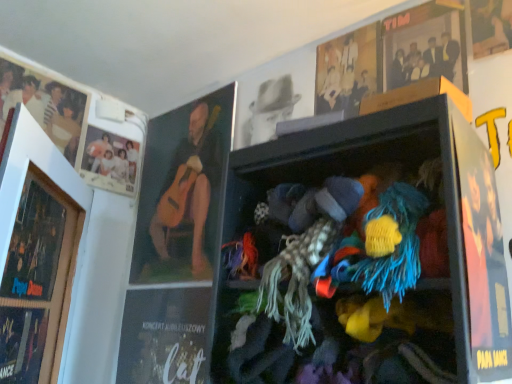
Locate an element on the screen. This screenshot has width=512, height=384. matte black magazine at lower left, which is the second magazine in back-to-front order is located at coordinates (22, 344).

What are the coordinates of `oil-painted guitar at upper left, which appears as the 2th person when viewed from the right` in the screenshot? It's located at (190, 188).

This screenshot has height=384, width=512. Identify the location of matte white photo at upper left, the 3th person in the right-to-left sequence. (111, 156).

Describe the element at coordinates (483, 255) in the screenshot. I see `matte black poster at right` at that location.

The height and width of the screenshot is (384, 512). I want to click on matte black photo frame at upper left, placed as the fourth person when sorted from right to left, so click(44, 105).

What do you see at coordinates (63, 231) in the screenshot? The width and height of the screenshot is (512, 384). I see `wooden picture frame at left` at bounding box center [63, 231].

This screenshot has width=512, height=384. I want to click on matte black magazine at lower left, which is the 1th magazine from front to back, so click(x=22, y=344).

In terms of width, does wooden picture frame at left look wider or thinner when compared to oil-painted guitar at upper left, which appears as the 2th person when viewed from the right?

In the image, wooden picture frame at left appears to be wider than oil-painted guitar at upper left, which appears as the 2th person when viewed from the right.

Considering the positions of objects wooden picture frame at left and oil-painted guitar at upper left, which is the 3th person in left-to-right order, in the image provided, who is more to the left, wooden picture frame at left or oil-painted guitar at upper left, which is the 3th person in left-to-right order,?

wooden picture frame at left.

From a real-world perspective, is wooden picture frame at left positioned above or below oil-painted guitar at upper left, which appears as the 2th person when viewed from the right?

In terms of real-world spatial position, wooden picture frame at left is below oil-painted guitar at upper left, which appears as the 2th person when viewed from the right.

Looking at this image, considering their positions, is wooden picture frame at left located in front of or behind oil-painted guitar at upper left, which appears as the 2th person when viewed from the right?

Visually, wooden picture frame at left is located in front of oil-painted guitar at upper left, which appears as the 2th person when viewed from the right.

How different are the orientations of matte black photo frame at upper left, placed as the fourth person when sorted from right to left, and matte black poster at right in degrees?

The angle between the facing direction of matte black photo frame at upper left, placed as the fourth person when sorted from right to left, and the facing direction of matte black poster at right is 0.0724 degrees.

Is matte black photo frame at upper left, which is the first person in left-to-right order, oriented away from matte black poster at right?

No.

From a real-world perspective, is matte black photo frame at upper left, which is the first person in left-to-right order, located beneath matte black poster at right?

No.

In the scene shown: Who is taller, matte black photo frame at upper left, which is the first person in left-to-right order, or matte black poster at right?

matte black poster at right.

Is matte black poster at right inside oil-painted guitar at upper left, which appears as the 2th person when viewed from the right?

That's incorrect, matte black poster at right is not inside oil-painted guitar at upper left, which appears as the 2th person when viewed from the right.

Is oil-painted guitar at upper left, which appears as the 2th person when viewed from the right, positioned far away from matte black poster at right?

Yes, oil-painted guitar at upper left, which appears as the 2th person when viewed from the right, and matte black poster at right are quite far apart.

Does oil-painted guitar at upper left, which is the 3th person in left-to-right order, have a greater height compared to matte black poster at right?

Yes.

Which is more to the right, oil-painted guitar at upper left, which is the 3th person in left-to-right order, or matte black poster at right?

From the viewer's perspective, matte black poster at right appears more on the right side.

Is matte black magazine at lower left, which is the first magazine from left to right, wider than oil-painted guitar at upper left, which is the 3th person in left-to-right order?

Yes, matte black magazine at lower left, which is the first magazine from left to right, is wider than oil-painted guitar at upper left, which is the 3th person in left-to-right order.

From a real-world perspective, is matte black magazine at lower left, which is the 1th magazine from front to back, physically below oil-painted guitar at upper left, which appears as the 2th person when viewed from the right?

Correct, in the physical world, matte black magazine at lower left, which is the 1th magazine from front to back, is lower than oil-painted guitar at upper left, which appears as the 2th person when viewed from the right.

Is matte black magazine at lower left, positioned as the 2th magazine in right-to-left order, outside of oil-painted guitar at upper left, which is the 3th person in left-to-right order?

matte black magazine at lower left, positioned as the 2th magazine in right-to-left order, is positioned outside oil-painted guitar at upper left, which is the 3th person in left-to-right order.

Is oil-painted guitar at upper left, which is the 3th person in left-to-right order, at the back of matte black magazine at lower left, which is the second magazine in back-to-front order?

No, matte black magazine at lower left, which is the second magazine in back-to-front order, is not facing the opposite direction of oil-painted guitar at upper left, which is the 3th person in left-to-right order.

In the scene shown: From the image's perspective, relative to matte black magazine at lower left, which is the second magazine in back-to-front order, is oil-painted guitar at upper left, which is the 3th person in left-to-right order, above or below?

From the image's perspective, oil-painted guitar at upper left, which is the 3th person in left-to-right order, appears above matte black magazine at lower left, which is the second magazine in back-to-front order.

From a real-world perspective, is oil-painted guitar at upper left, which appears as the 2th person when viewed from the right, under matte black magazine at lower left, which is the second magazine in back-to-front order?

No.

How many degrees apart are the facing directions of light brown wooden frame at upper center, which ranks as the fourth person in left-to-right order, and oil-painted guitar at upper left, which is the 3th person in left-to-right order?

0.00251 degrees.

Where is `person that is on the right side of oil-painted guitar at upper left, which is the 3th person in left-to-right order`? The width and height of the screenshot is (512, 384). person that is on the right side of oil-painted guitar at upper left, which is the 3th person in left-to-right order is located at coordinates (346, 70).

How much distance is there between light brown wooden frame at upper center, which is counted as the 1th person, starting from the right, and oil-painted guitar at upper left, which appears as the 2th person when viewed from the right?

The distance of light brown wooden frame at upper center, which is counted as the 1th person, starting from the right, from oil-painted guitar at upper left, which appears as the 2th person when viewed from the right, is 24.34 inches.

Which is correct: light brown wooden frame at upper center, which is counted as the 1th person, starting from the right, is inside oil-painted guitar at upper left, which is the 3th person in left-to-right order, or outside of it?

light brown wooden frame at upper center, which is counted as the 1th person, starting from the right, is not inside oil-painted guitar at upper left, which is the 3th person in left-to-right order, it's outside.

How many degrees apart are the facing directions of light brown wooden frame at upper center, which ranks as the fourth person in left-to-right order, and black paper magazine at lower left, the 2th magazine positioned from the left?

The angle between the facing direction of light brown wooden frame at upper center, which ranks as the fourth person in left-to-right order, and the facing direction of black paper magazine at lower left, the 2th magazine positioned from the left, is 0.000731 degrees.

Which object is positioned more to the right, light brown wooden frame at upper center, which is counted as the 1th person, starting from the right, or black paper magazine at lower left, the 2th magazine positioned from the left?

light brown wooden frame at upper center, which is counted as the 1th person, starting from the right, is more to the right.

Which of these two, light brown wooden frame at upper center, which is counted as the 1th person, starting from the right, or black paper magazine at lower left, placed as the 2th magazine when sorted from front to back, is smaller?

light brown wooden frame at upper center, which is counted as the 1th person, starting from the right.

Is the surface of light brown wooden frame at upper center, which ranks as the fourth person in left-to-right order, in direct contact with black paper magazine at lower left, the 2th magazine positioned from the left?

No, light brown wooden frame at upper center, which ranks as the fourth person in left-to-right order, is not with black paper magazine at lower left, the 2th magazine positioned from the left.

Find the location of `picture frame in front of the oil-painted guitar at upper left, which is the 3th person in left-to-right order`. picture frame in front of the oil-painted guitar at upper left, which is the 3th person in left-to-right order is located at coordinates (63, 231).

Identify the location of poster page that appears below the matte black photo frame at upper left, placed as the fourth person when sorted from right to left (from the image's perspective). (483, 255).

Which object lies further to the anchor point wooden picture frame at left, black paper magazine at lower left, the 2th magazine positioned from the left, or matte black poster at right?

matte black poster at right is positioned further to the anchor wooden picture frame at left.

From the image, which object appears to be nearer to matte black magazine at lower left, positioned as the 2th magazine in right-to-left order, matte black photo frame at upper left, which is the first person in left-to-right order, or black paper magazine at lower left, placed as the 2th magazine when sorted from front to back?

black paper magazine at lower left, placed as the 2th magazine when sorted from front to back, lies closer to matte black magazine at lower left, positioned as the 2th magazine in right-to-left order, than the other object.

Based on their spatial positions, is matte black poster at right or matte black photo frame at upper left, which is the first person in left-to-right order, closer to matte black magazine at lower left, which is the 1th magazine from front to back?

matte black photo frame at upper left, which is the first person in left-to-right order, lies closer to matte black magazine at lower left, which is the 1th magazine from front to back, than the other object.

Looking at the image, which one is located closer to black paper magazine at lower left, acting as the first magazine starting from the right, oil-painted guitar at upper left, which appears as the 2th person when viewed from the right, or matte black photo frame at upper left, which is the first person in left-to-right order?

The object closer to black paper magazine at lower left, acting as the first magazine starting from the right, is oil-painted guitar at upper left, which appears as the 2th person when viewed from the right.

Estimate the real-world distances between objects in this image. Which object is further from wooden picture frame at left, matte black magazine at lower left, which is the second magazine in back-to-front order, or matte black photo frame at upper left, which is the first person in left-to-right order?

matte black photo frame at upper left, which is the first person in left-to-right order, is further to wooden picture frame at left.

Considering their positions, is light brown wooden frame at upper center, which is counted as the 1th person, starting from the right, positioned further to wooden picture frame at left than matte black poster at right?

matte black poster at right.

When comparing their distances from matte black magazine at lower left, which is the second magazine in back-to-front order, does light brown wooden frame at upper center, which is counted as the 1th person, starting from the right, or black paper magazine at lower left, positioned as the 1th magazine in back-to-front order, seem further?

Among the two, light brown wooden frame at upper center, which is counted as the 1th person, starting from the right, is located further to matte black magazine at lower left, which is the second magazine in back-to-front order.

From the image, which object appears to be farther from matte black photo frame at upper left, which is the first person in left-to-right order, light brown wooden frame at upper center, which is counted as the 1th person, starting from the right, or oil-painted guitar at upper left, which appears as the 2th person when viewed from the right?

Based on the image, light brown wooden frame at upper center, which is counted as the 1th person, starting from the right, appears to be further to matte black photo frame at upper left, which is the first person in left-to-right order.

At what (x,y) coordinates should I click in order to perform the action: click on magazine between matte black photo frame at upper left, placed as the fourth person when sorted from right to left, and black paper magazine at lower left, placed as the 2th magazine when sorted from front to back, from top to bottom. Please return your answer as a coordinate pair (x, y). This screenshot has height=384, width=512. Looking at the image, I should click on (22, 344).

Where is `poster page between light brown wooden frame at upper center, which is counted as the 1th person, starting from the right, and black paper magazine at lower left, acting as the first magazine starting from the right, in the up-down direction`? This screenshot has width=512, height=384. poster page between light brown wooden frame at upper center, which is counted as the 1th person, starting from the right, and black paper magazine at lower left, acting as the first magazine starting from the right, in the up-down direction is located at coordinates (483, 255).

Find the location of a particular element. picture frame that lies between matte black photo frame at upper left, which is the first person in left-to-right order, and black paper magazine at lower left, acting as the first magazine starting from the right, from top to bottom is located at coordinates (63, 231).

Where is `picture frame between matte black photo frame at upper left, which is the first person in left-to-right order, and light brown wooden frame at upper center, which is counted as the 1th person, starting from the right, from left to right`? The height and width of the screenshot is (384, 512). picture frame between matte black photo frame at upper left, which is the first person in left-to-right order, and light brown wooden frame at upper center, which is counted as the 1th person, starting from the right, from left to right is located at coordinates (63, 231).